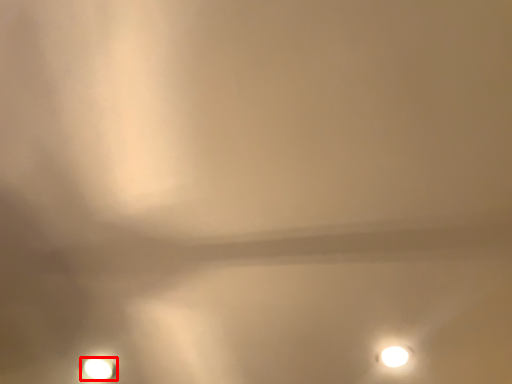
Question: From the image's perspective, where is lamp (annotated by the red box) located in relation to lamp in the image?

Choices:
 (A) below
 (B) above

Answer: (A)